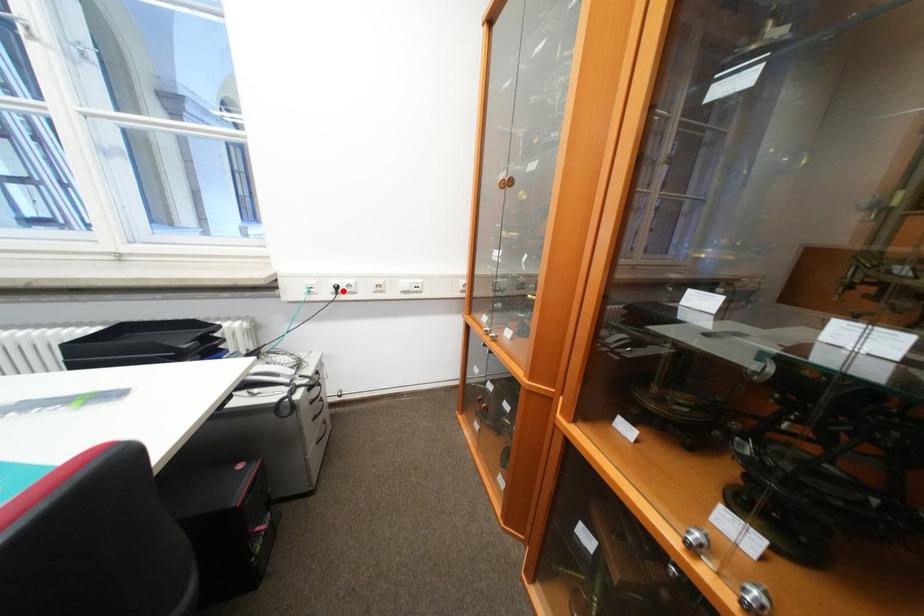
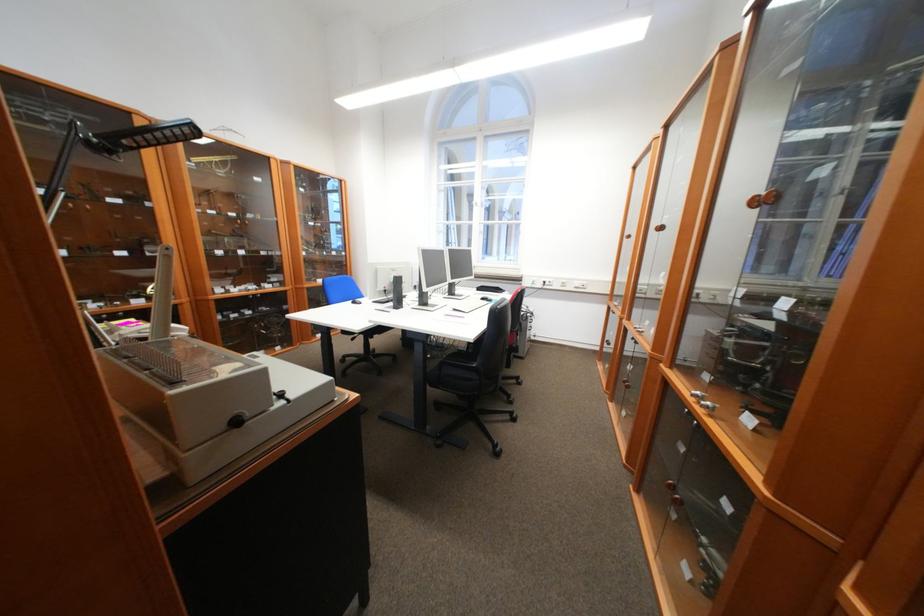
Find the pixel in the second image that matches the highlighted location in the first image.

(553, 284)